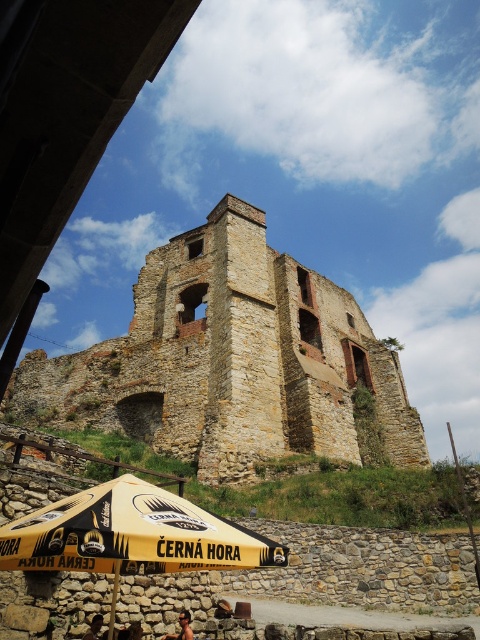
Question: Does sun-kissed skin at lower center appear on the left side of brown leather chair at lower center?

Choices:
 (A) no
 (B) yes

Answer: (A)

Question: Which object is closer to the camera taking this photo?

Choices:
 (A) yellow fabric umbrella at lower center
 (B) stone brick castle at center
 (C) brown leather chair at lower center

Answer: (A)

Question: Is stone brick castle at center positioned before brown leather chair at lower center?

Choices:
 (A) yes
 (B) no

Answer: (B)

Question: Which point is closer to the camera?

Choices:
 (A) (192, 636)
 (B) (99, 625)
 (C) (203, 392)
 (D) (135, 632)

Answer: (B)

Question: Is yellow fabric umbrella at lower center wider than dark brown leather jacket at lower left?

Choices:
 (A) yes
 (B) no

Answer: (A)

Question: Estimate the real-world distances between objects in this image. Which object is closer to the sun-kissed skin at lower center?

Choices:
 (A) yellow fabric umbrella at lower center
 (B) brown leather chair at lower center
 (C) dark brown leather jacket at lower left

Answer: (B)